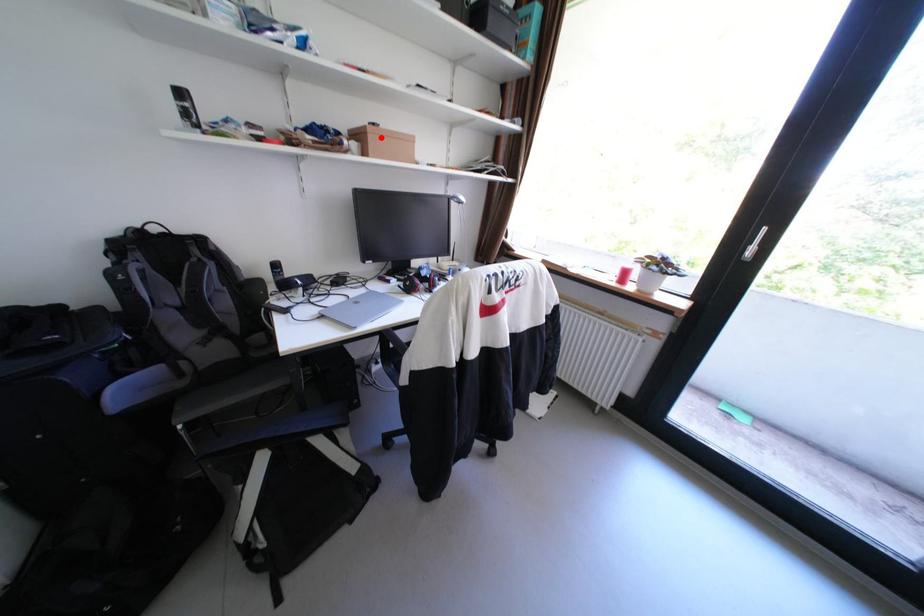
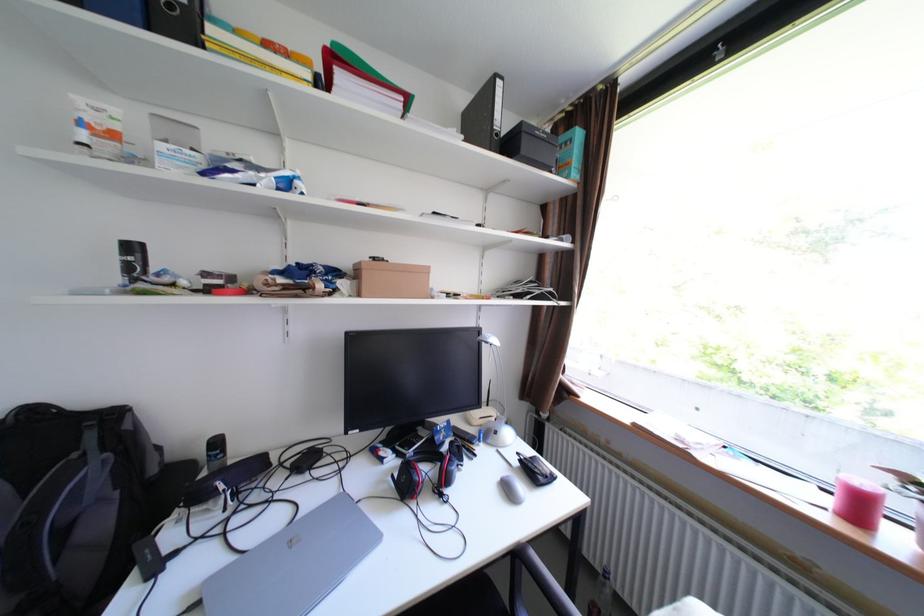
In the second image, find the point that corresponds to the highlighted location in the first image.

(375, 275)